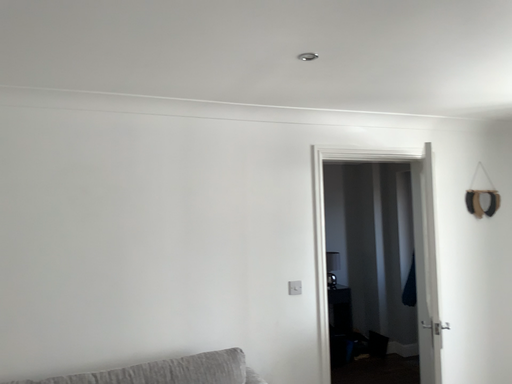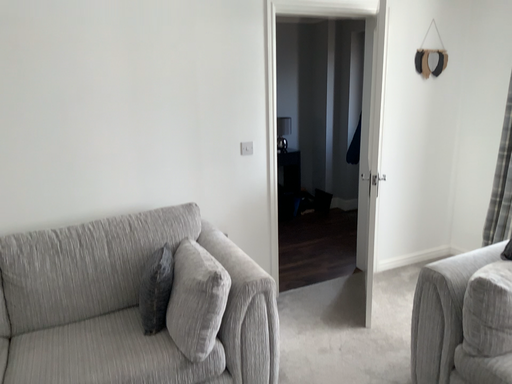
Question: Which way did the camera rotate in the video?

Choices:
 (A) rotated downward
 (B) rotated upward

Answer: (A)